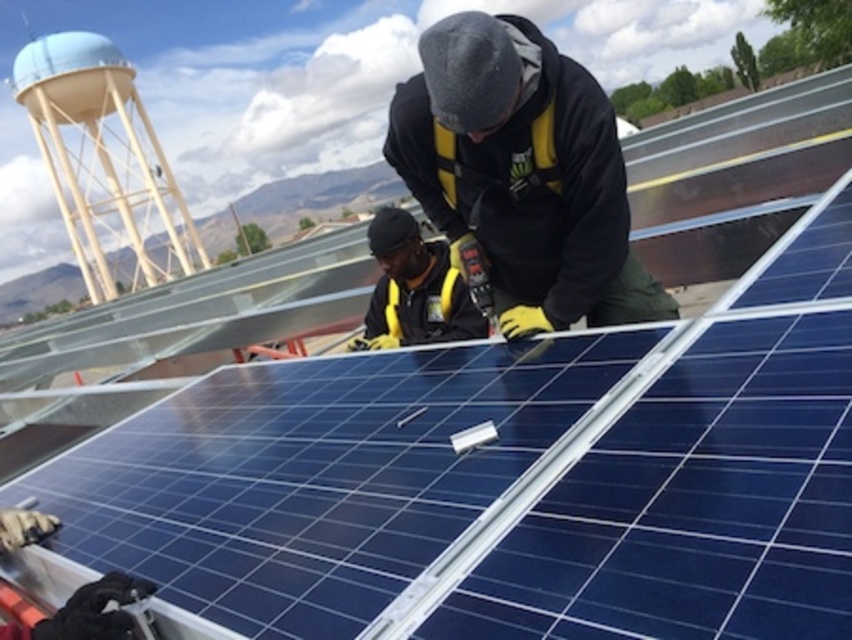
You are a safety inspector at the construction site. You notice the white matte water tower at upper left and the yellow safety vest at center. According to safety regulations, the minimum safe distance between any worker and the water tower is 50 meters. Is the current distance compliant with the regulation?

The white matte water tower at upper left is 52.93 meters from the yellow safety vest at center. Since 52.93 meters exceeds the minimum required 50 meters, the current distance is compliant with the safety regulation.

You are a safety inspector reviewing the rooftop solar panel installation. You notice the yellow reflective safety vest at center. Based on its position at coordinates point 0.272, 0.614, can you determine if it is placed in a safe location relative to the solar panels and the workers?

The yellow reflective safety vest at center is located at point (522, 173), which is within the array of solar panels. Since the workers are actively installing panels, the vest should be placed in an area free of obstructions and away from the work zone to avoid hindrance. However, without additional spatial context about the roof layout, it is difficult to definitively assess safety. Recommend verifying with on site personnel.